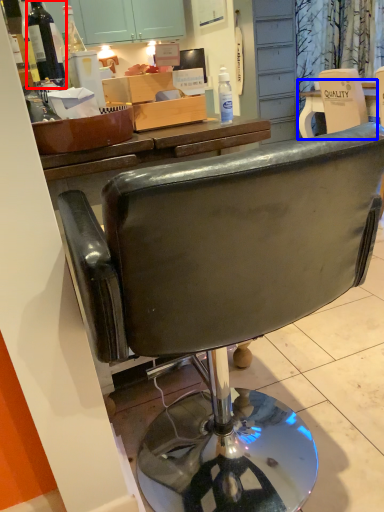
Question: Which object is further to the camera taking this photo, bottle (highlighted by a red box) or desk (highlighted by a blue box)?

Choices:
 (A) bottle
 (B) desk

Answer: (B)